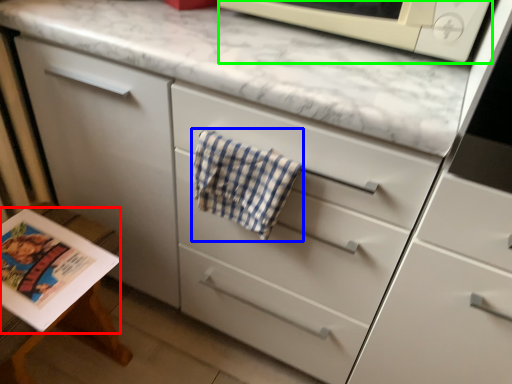
Question: Which is nearer to the magazine (highlighted by a red box)? beach towel (highlighted by a blue box) or microwave oven (highlighted by a green box).

Choices:
 (A) beach towel
 (B) microwave oven

Answer: (A)